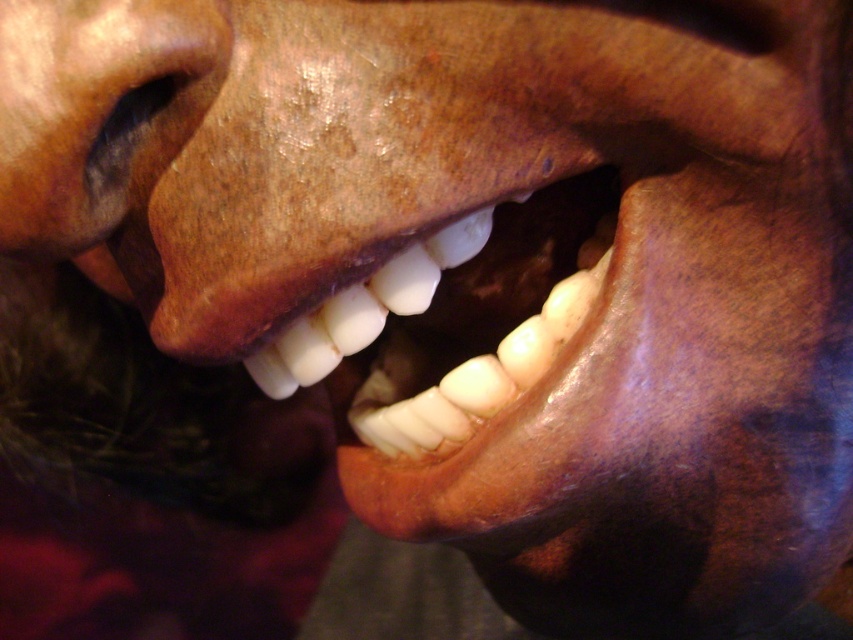
Looking at the image of two smiling individuals, can you determine which feature is positioned lower on their faces between the white glossy teeth at center and the matte brown nose at center?

The white glossy teeth at center are positioned below the matte brown nose at center, so the teeth are lower on their faces.

You are a photographer adjusting the focus of a camera. The camera has a focus point at coordinates 0.502, 0.542. Which object in the image should you focus on to capture the white glossy teeth at center?

The white glossy teeth at center are positioned at point [461,321], so you should focus on the white glossy teeth at center to capture them clearly.

You are a photographer trying to focus on the white glossy teeth at center and the matte brown nose at center in this closeup portrait. Which object is closer to the camera?

The white glossy teeth at center are closer to the camera than the matte brown nose at center because the nose is positioned behind the teeth.